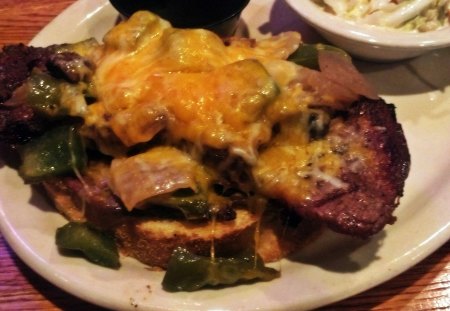
Locate an element on the screen. Image resolution: width=450 pixels, height=311 pixels. wooden surface is located at coordinates (415, 304), (36, 293), (36, 10).